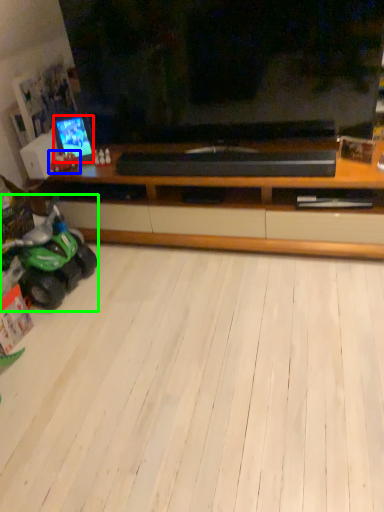
Question: Considering the real-world distances, which object is farthest from tv show (highlighted by a red box)? land vehicle (highlighted by a blue box) or land vehicle (highlighted by a green box)?

Choices:
 (A) land vehicle
 (B) land vehicle

Answer: (B)